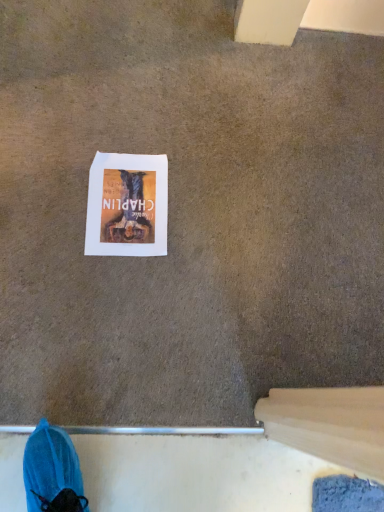
Identify the location of free space above white paper at center (from a real-world perspective). The width and height of the screenshot is (384, 512). (123, 201).